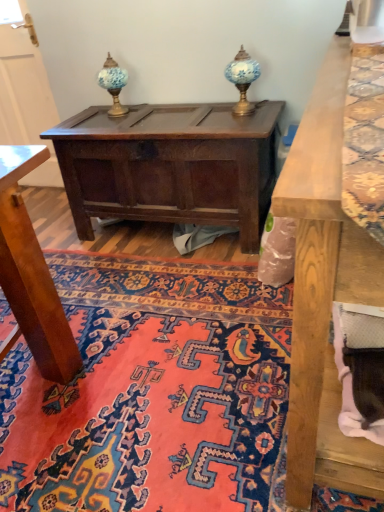
Question: Is blue glass table lamp at upper center, arranged as the 2th table lamp when viewed from the right, outside of blue glass table lamp at upper center, the second table lamp from the left?

Choices:
 (A) no
 (B) yes

Answer: (B)

Question: Does blue glass table lamp at upper center, which is counted as the 1th table lamp, starting from the left, contain blue glass table lamp at upper center, positioned as the 1th table lamp in right-to-left order?

Choices:
 (A) no
 (B) yes

Answer: (A)

Question: Is blue glass table lamp at upper center, which is counted as the 1th table lamp, starting from the left, turned away from blue glass table lamp at upper center, the second table lamp from the left?

Choices:
 (A) no
 (B) yes

Answer: (A)

Question: Is blue glass table lamp at upper center, which is counted as the 1th table lamp, starting from the left, positioned before blue glass table lamp at upper center, the second table lamp from the left?

Choices:
 (A) no
 (B) yes

Answer: (A)

Question: Can you see blue glass table lamp at upper center, which is counted as the 1th table lamp, starting from the left, touching blue glass table lamp at upper center, positioned as the 1th table lamp in right-to-left order?

Choices:
 (A) yes
 (B) no

Answer: (B)

Question: Is blue glass table lamp at upper center, arranged as the 2th table lamp when viewed from the right, facing towards blue glass table lamp at upper center, the second table lamp from the left?

Choices:
 (A) no
 (B) yes

Answer: (A)

Question: Is blue glass table lamp at upper center, which is counted as the 1th table lamp, starting from the left, further to camera compared to dark brown wood chest at center?

Choices:
 (A) yes
 (B) no

Answer: (A)

Question: Is blue glass table lamp at upper center, arranged as the 2th table lamp when viewed from the right, to the left of dark brown wood chest at center from the viewer's perspective?

Choices:
 (A) yes
 (B) no

Answer: (A)

Question: From a real-world perspective, does blue glass table lamp at upper center, which is counted as the 1th table lamp, starting from the left, stand above dark brown wood chest at center?

Choices:
 (A) yes
 (B) no

Answer: (A)

Question: Can you confirm if blue glass table lamp at upper center, arranged as the 2th table lamp when viewed from the right, is positioned to the right of dark brown wood chest at center?

Choices:
 (A) no
 (B) yes

Answer: (A)

Question: Considering the relative sizes of blue glass table lamp at upper center, which is counted as the 1th table lamp, starting from the left, and dark brown wood chest at center in the image provided, is blue glass table lamp at upper center, which is counted as the 1th table lamp, starting from the left, thinner than dark brown wood chest at center?

Choices:
 (A) yes
 (B) no

Answer: (A)

Question: From a real-world perspective, is dark brown wood chest at center physically above blue glass table lamp at upper center, which is counted as the 1th table lamp, starting from the left?

Choices:
 (A) yes
 (B) no

Answer: (B)